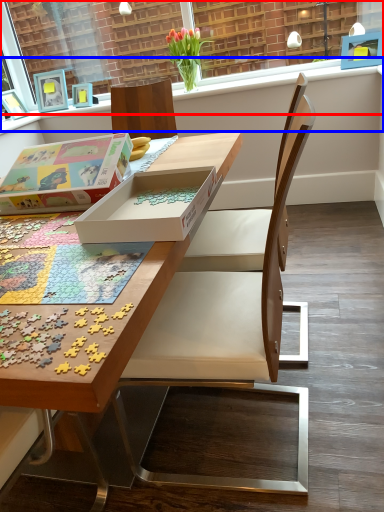
Question: Which point is closer to the camera, window frame (highlighted by a red box) or window sill (highlighted by a blue box)?

Choices:
 (A) window frame
 (B) window sill

Answer: (A)